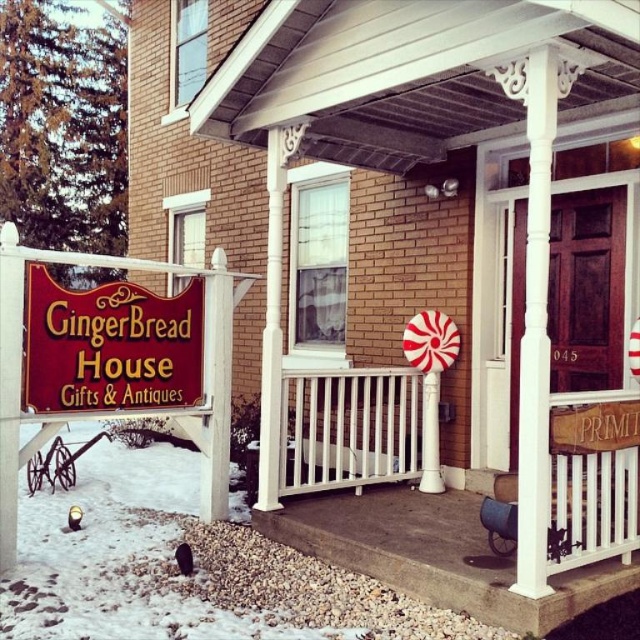
Question: Among these objects, which one is nearest to the camera?

Choices:
 (A) wooden signboard at lower left
 (B) white carved wood pillar at center

Answer: (B)

Question: Can you confirm if wooden signboard at lower left is thinner than white carved wood pillar at center?

Choices:
 (A) no
 (B) yes

Answer: (A)

Question: Is wooden signboard at lower left to the left of white carved wood pillar at center from the viewer's perspective?

Choices:
 (A) yes
 (B) no

Answer: (A)

Question: Which point is closer to the camera taking this photo?

Choices:
 (A) coord(108,369)
 (B) coord(548,112)

Answer: (B)

Question: Is wooden signboard at lower left bigger than white carved wood pillar at center?

Choices:
 (A) no
 (B) yes

Answer: (B)